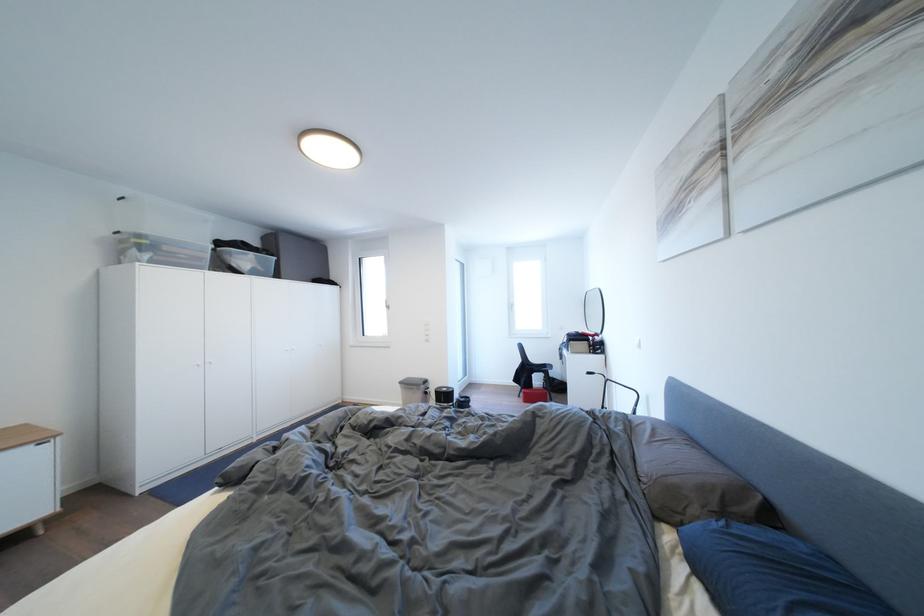
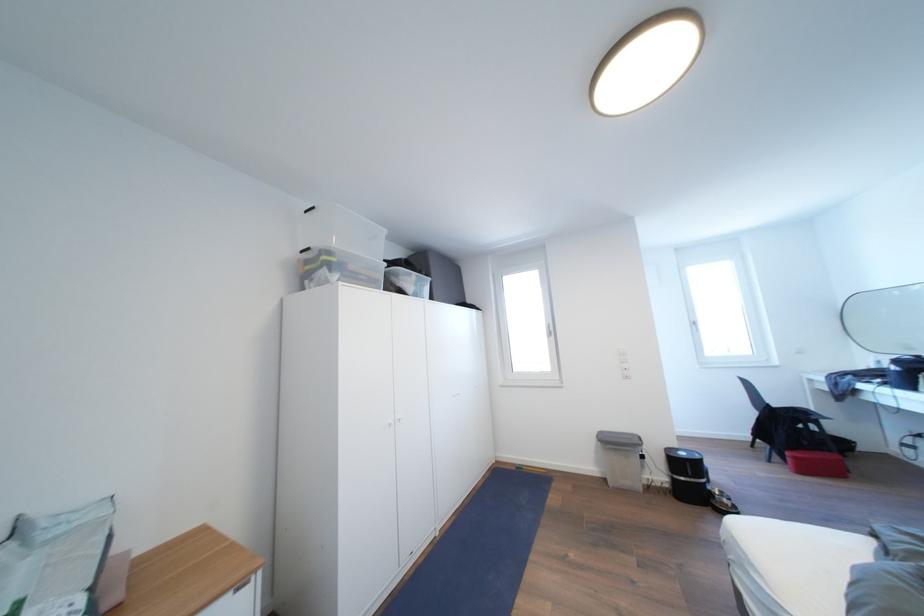
In the second image, find the point that corresponds to point (532, 398) in the first image.

(803, 463)